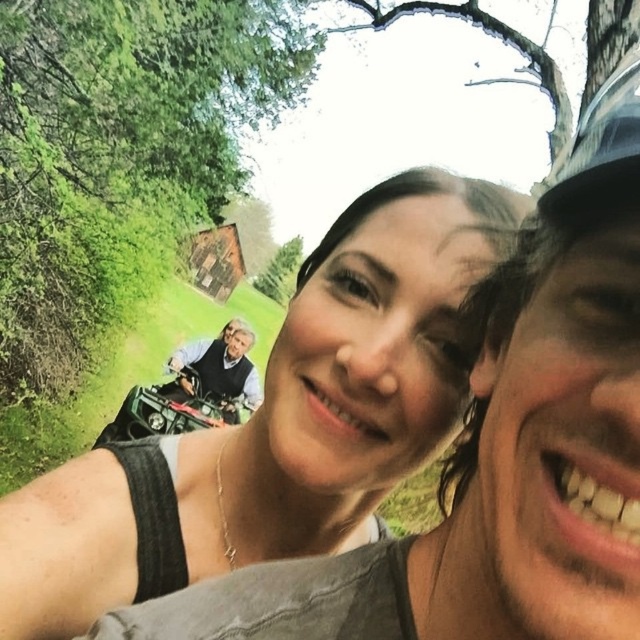
You are taking a selfie with two people in a green area. You notice the matte black tank top at center and the light brown leather jacket at center. Which clothing item is more to the right?

The matte black tank top at center is more to the right because it is positioned on the right side of the light brown leather jacket at center.

You are a photographer trying to capture a clear shot of both the matte black tank top at center and the light brown leather jacket at center. Since you want to focus on the smaller object, which one should you zoom in on?

The matte black tank top at center occupies less space than the light brown leather jacket at center, so you should zoom in on the matte black tank top at center to focus on the smaller object.

You are taking a selfie with two people in a green area. You notice a point at coordinates (276, 422). What object is located at that point?

The point at coordinates (276, 422) corresponds to the matte black tank top at center.